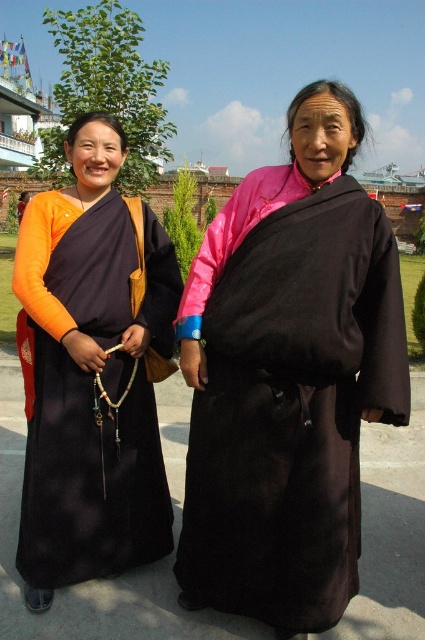
Does black silk dress at center have a larger size compared to matte black robe at left?

Correct, black silk dress at center is larger in size than matte black robe at left.

Can you confirm if black silk dress at center is positioned to the right of matte black robe at left?

Correct, you'll find black silk dress at center to the right of matte black robe at left.

Is point (368, 344) more distant than point (132, 493)?

No, (368, 344) is in front of (132, 493).

Identify the location of black silk dress at center. (286, 396).